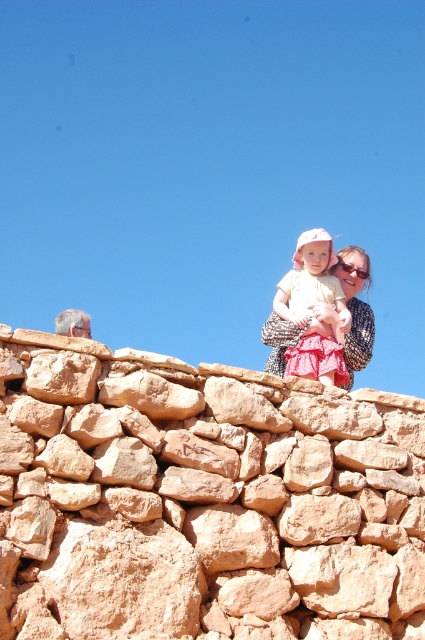
Question: Is rustic stone wall at upper center above matte pink dress at upper center?

Choices:
 (A) yes
 (B) no

Answer: (B)

Question: Where is rustic stone wall at upper center located in relation to matte pink dress at upper center in the image?

Choices:
 (A) above
 (B) below

Answer: (B)

Question: Observing the image, what is the correct spatial positioning of rustic stone wall at upper center in reference to matte pink dress at upper center?

Choices:
 (A) right
 (B) left

Answer: (B)

Question: Among these points, which one is nearest to the camera?

Choices:
 (A) (306, 307)
 (B) (197, 499)

Answer: (B)

Question: Which of the following is the closest to the observer?

Choices:
 (A) rustic stone wall at upper center
 (B) matte pink dress at upper center

Answer: (A)